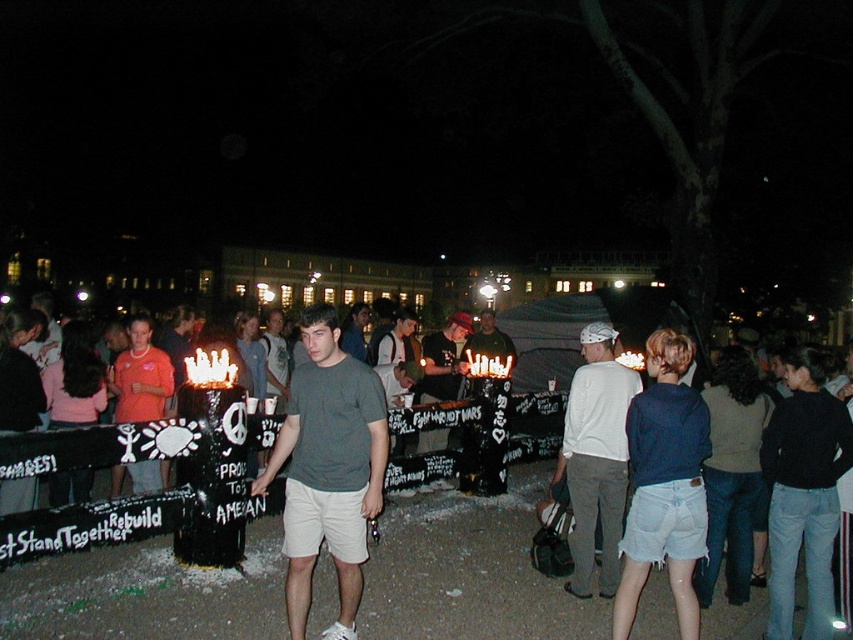
Does white matte shirt at center have a lesser width compared to matte black t-shirt at center?

No.

The image size is (853, 640). Identify the location of white matte shirt at center. (596, 458).

The height and width of the screenshot is (640, 853). In order to click on white matte shirt at center in this screenshot , I will do `click(596, 458)`.

Does gray cotton t-shirt at center have a larger size compared to matte black t-shirt at center?

Yes, gray cotton t-shirt at center is bigger than matte black t-shirt at center.

Can you confirm if gray cotton t-shirt at center is smaller than matte black t-shirt at center?

No, gray cotton t-shirt at center is not smaller than matte black t-shirt at center.

Does point (310, 536) lie in front of point (456, 376)?

Yes, it is.

This screenshot has height=640, width=853. What are the coordinates of `gray cotton t-shirt at center` in the screenshot? It's located at (328, 468).

How far apart are gray cotton t-shirt at center and white matte shirt at center?

gray cotton t-shirt at center is 5.93 feet away from white matte shirt at center.

Looking at this image, who is more distant from viewer, (299, 390) or (605, 474)?

The point (605, 474) is more distant.

Find the location of a particular element. This screenshot has height=640, width=853. gray cotton t-shirt at center is located at coordinates (328, 468).